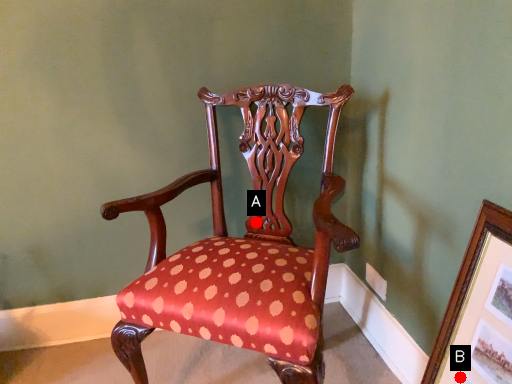
Question: Two points are circled on the image, labeled by A and B beside each circle. Which of the following is the farthest from the observer?

Choices:
 (A) A is further
 (B) B is further

Answer: (A)